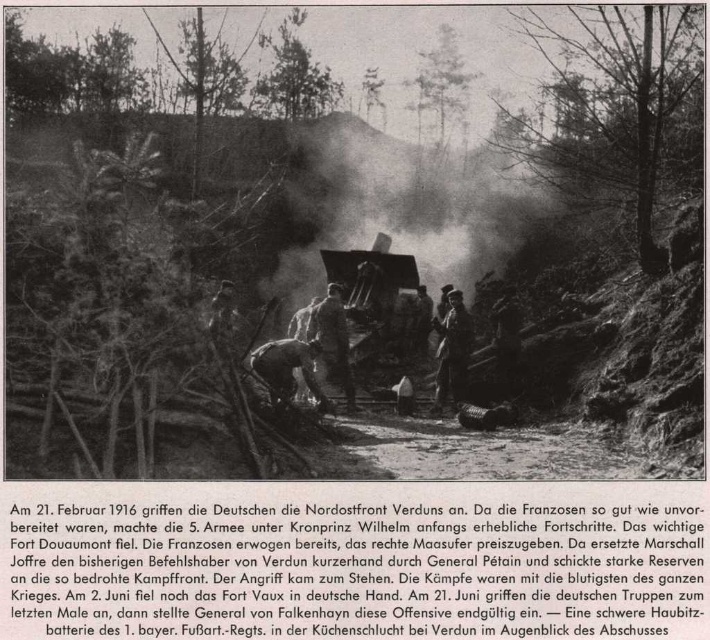
Question: Where is smoketransparentatcenter located in relation to dark brown leather helmet at center in the image?

Choices:
 (A) above
 (B) below

Answer: (A)

Question: Based on their relative distances, which object is nearer to the smoketransparentatcenter?

Choices:
 (A) light brown leather jacket at center
 (B) dark brown leather helmet at center

Answer: (A)

Question: Is smoketransparentatcenter smaller than dark gray uniform at center?

Choices:
 (A) no
 (B) yes

Answer: (A)

Question: Can you confirm if smoketransparentatcenter is bigger than dark brown leather helmet at center?

Choices:
 (A) yes
 (B) no

Answer: (A)

Question: Which point appears closest to the camera in this image?

Choices:
 (A) (283, 397)
 (B) (454, 374)
 (C) (410, 168)

Answer: (A)

Question: Based on their relative distances, which object is nearer to the dark gray uniform at center?

Choices:
 (A) smoketransparentatcenter
 (B) light brown leather jacket at center

Answer: (B)